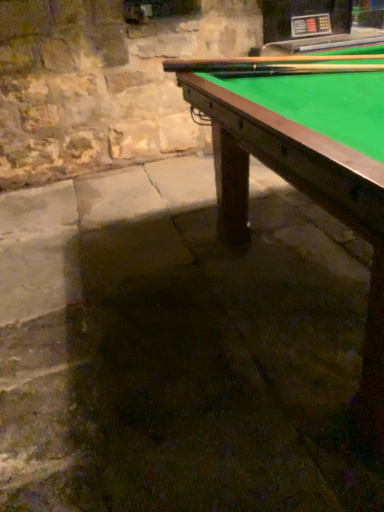
Where is `free region under wooden cue at upper right, positioned as the second cue in bottom-to-top order (from a real-world perspective)`? free region under wooden cue at upper right, positioned as the second cue in bottom-to-top order (from a real-world perspective) is located at coordinates (306, 66).